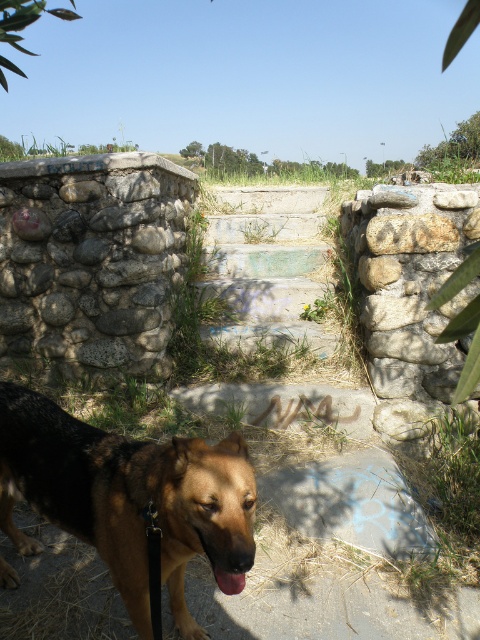
Question: Does brown matte dog at lower left appear on the left side of brown matte dog mouth at lower center?

Choices:
 (A) no
 (B) yes

Answer: (B)

Question: Which object appears farthest from the camera in this image?

Choices:
 (A) brown matte dog mouth at lower center
 (B) gray rough stone at center
 (C) brown matte dog at lower left
 (D) natural stone wall at upper left

Answer: (D)

Question: Which object appears farthest from the camera in this image?

Choices:
 (A) brown matte dog mouth at lower center
 (B) gray rough stone at center
 (C) natural stone wall at upper left

Answer: (C)

Question: Among these points, which one is farthest from the camera?

Choices:
 (A) (170, 604)
 (B) (240, 576)

Answer: (A)

Question: Is natural stone wall at upper left wider than brown matte dog at lower left?

Choices:
 (A) yes
 (B) no

Answer: (A)

Question: Where is gray rough stone at center located in relation to brown matte dog mouth at lower center in the image?

Choices:
 (A) right
 (B) left

Answer: (A)